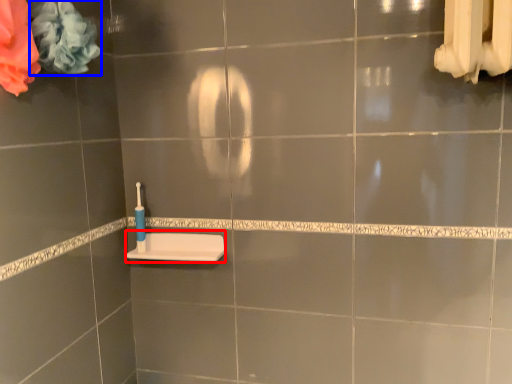
Question: Which of the following is the farthest to the observer, sink (highlighted by a red box) or flower (highlighted by a blue box)?

Choices:
 (A) sink
 (B) flower

Answer: (A)